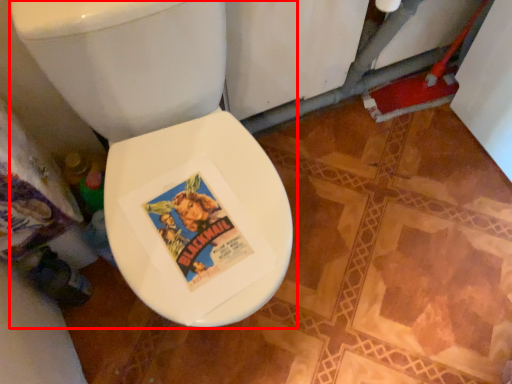
Question: From the image's perspective, what is the correct spatial relationship of toilet (annotated by the red box) in relation to bidet?

Choices:
 (A) above
 (B) below

Answer: (A)